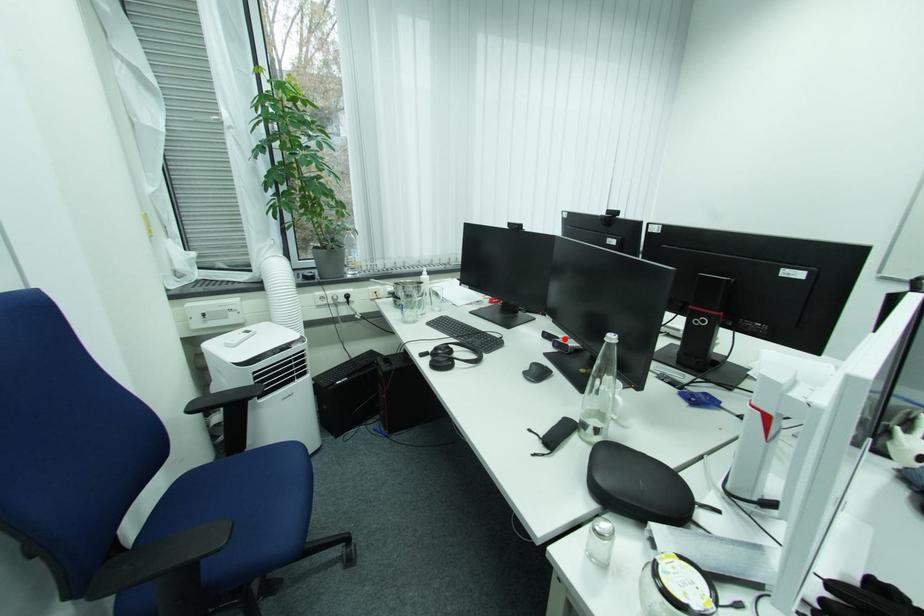
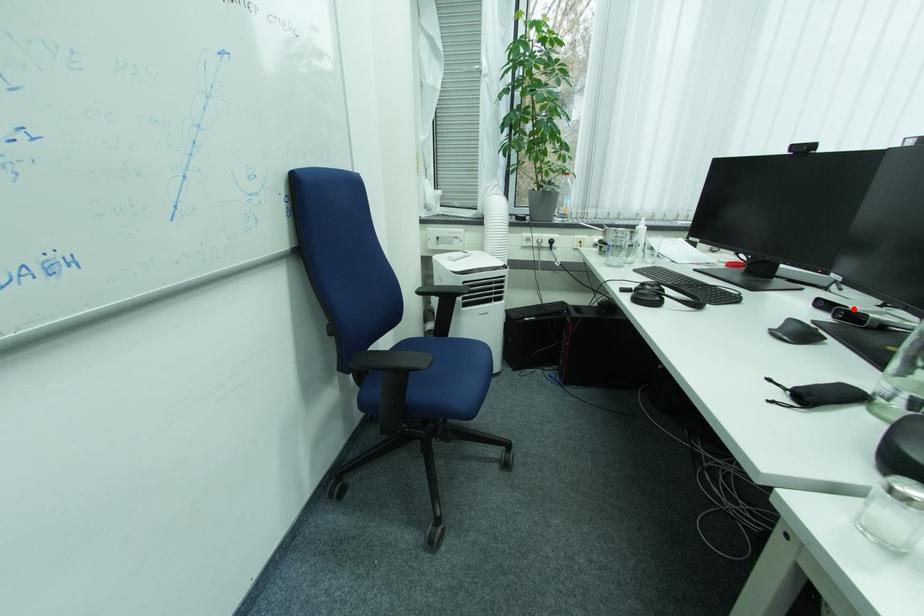
I am providing you with two images of the same scene from different viewpoints. A red point is marked on the first image and another point is marked on the second image. Is the red point in image1 aligned with the point shown in image2?

Yes